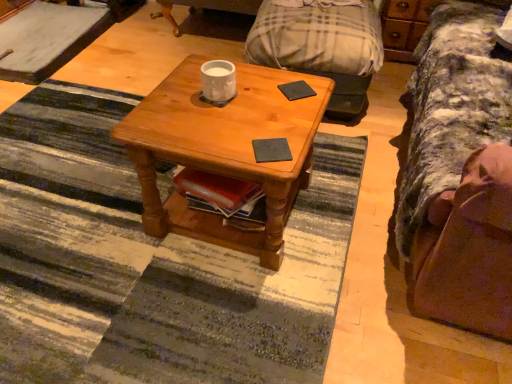
You are a GUI agent. You are given a task and a screenshot of the screen. Output one action in this format:
    pyautogui.click(x=<x>, y=<y>)
    Task: Click on the vacant space that's between black matte pad at center, the first pad when ordered from top to bottom, and black matte pad at center, the first pad from the bottom
    The width and height of the screenshot is (512, 384).
    Given the screenshot: What is the action you would take?
    pyautogui.click(x=287, y=117)